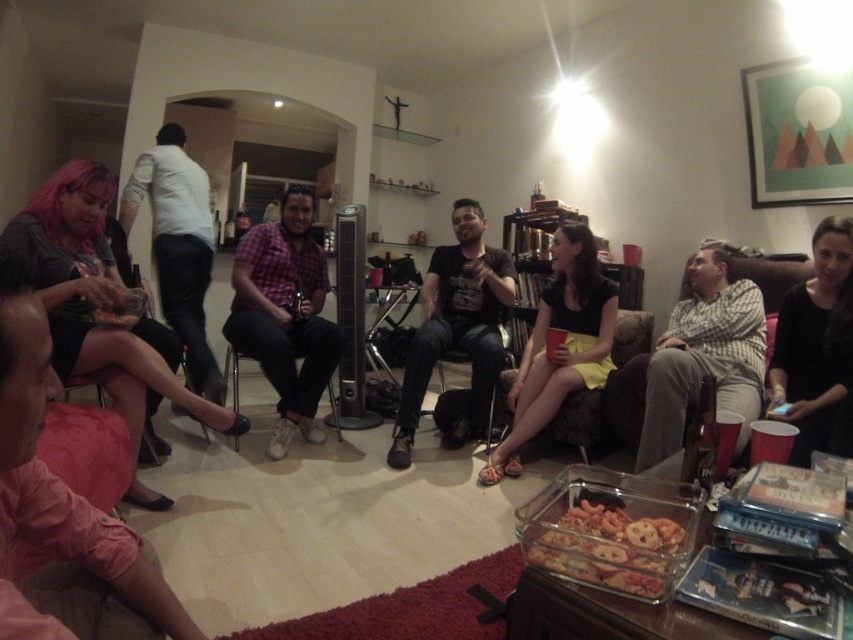
Which is behind, point (498, 337) or point (621, 524)?

Point (498, 337)

Who is positioned more to the left, black cotton shirt at center or translucent glass dish at lower center?

Positioned to the left is black cotton shirt at center.

Where is `black cotton shirt at center`? Image resolution: width=853 pixels, height=640 pixels. black cotton shirt at center is located at coordinates (456, 330).

The width and height of the screenshot is (853, 640). Identify the location of black cotton shirt at center. (456, 330).

Between matte black dress at lower left and yellow fabric skirt at center, which one appears on the right side from the viewer's perspective?

yellow fabric skirt at center

Which is in front, point (1, 241) or point (608, 346)?

Positioned in front is point (1, 241).

Describe the element at coordinates (100, 305) in the screenshot. I see `matte black dress at lower left` at that location.

This screenshot has width=853, height=640. What are the coordinates of `matte black dress at lower left` in the screenshot? It's located at click(100, 305).

Can you confirm if plaid fabric shirt at center is positioned above translucent glass dish at lower center?

Indeed, plaid fabric shirt at center is positioned over translucent glass dish at lower center.

Between plaid fabric shirt at center and translucent glass dish at lower center, which one appears on the left side from the viewer's perspective?

plaid fabric shirt at center is more to the left.

Who is more distant from viewer, (268, 314) or (648, 564)?

The point (268, 314) is behind.

The image size is (853, 640). Find the location of `plaid fabric shirt at center`. plaid fabric shirt at center is located at coordinates (285, 316).